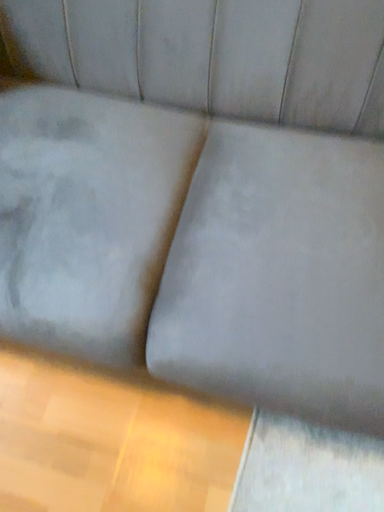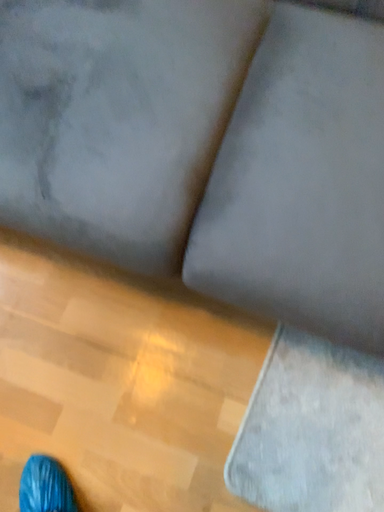
Question: How did the camera likely rotate when shooting the video?

Choices:
 (A) rotated upward
 (B) rotated downward

Answer: (B)